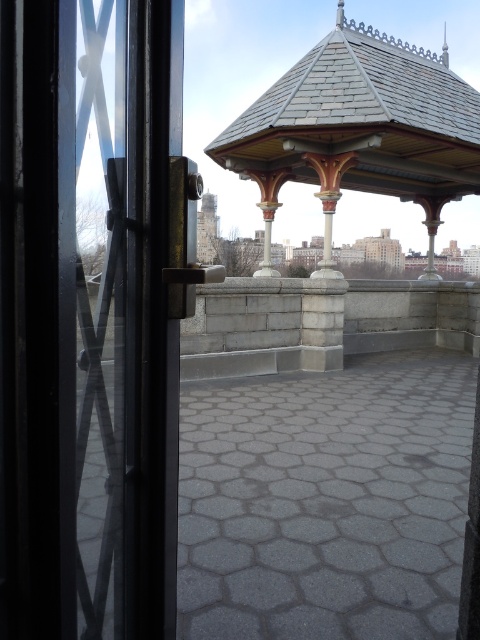
Question: Among these objects, which one is farthest from the camera?

Choices:
 (A) gray slate gazebo at upper center
 (B) transparent glass door at left

Answer: (A)

Question: Is the position of transparent glass door at left less distant than that of gray slate gazebo at upper center?

Choices:
 (A) no
 (B) yes

Answer: (B)

Question: Can you confirm if transparent glass door at left is wider than gray slate gazebo at upper center?

Choices:
 (A) yes
 (B) no

Answer: (B)

Question: Does transparent glass door at left come in front of gray slate gazebo at upper center?

Choices:
 (A) no
 (B) yes

Answer: (B)

Question: Which point is farther to the camera?

Choices:
 (A) gray slate gazebo at upper center
 (B) transparent glass door at left

Answer: (A)

Question: Which object is closer to the camera taking this photo?

Choices:
 (A) gray slate gazebo at upper center
 (B) transparent glass door at left

Answer: (B)